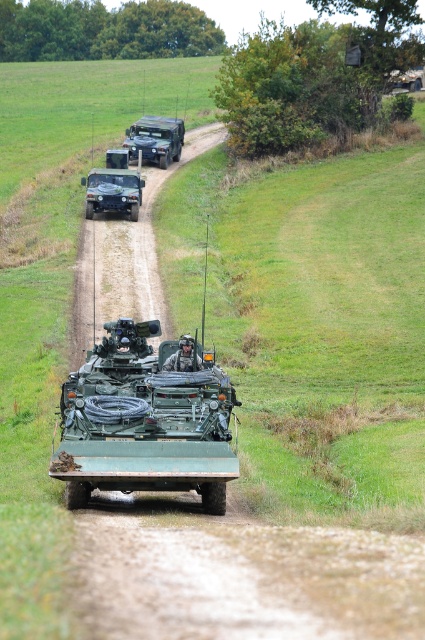
In the scene shown: You are a drone operator observing the military convoy. You notice two points marked on your screen at coordinates point (104,348) and point (101,209). Which point is nearer to your drone camera?

Point (104,348) is closer to the camera than point (101,209).

You are a military planner trying to determine the best vehicle for a narrow path. Given that the green matte tank at center and the matte green military vehicle at center are both available, which one would you choose if you need a wider vehicle for transporting more supplies?

The matte green military vehicle at center has a greater width than the green matte tank at center, making it more suitable for transporting more supplies due to its wider size.

You are a military planner assessing the convoy layout. You need to determine which vehicle, the green matte tank at center or the matte green military vehicle at center, can carry more equipment based on their sizes. Which one has a larger size?

The matte green military vehicle at center is larger than the green matte tank at center, so it can carry more equipment.